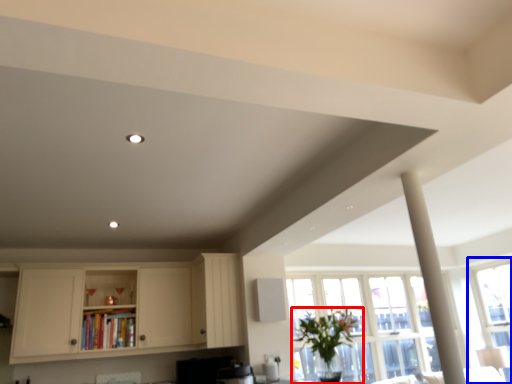
Question: Which object appears farthest to the camera in this image, houseplant (highlighted by a red box) or window (highlighted by a blue box)?

Choices:
 (A) houseplant
 (B) window

Answer: (B)